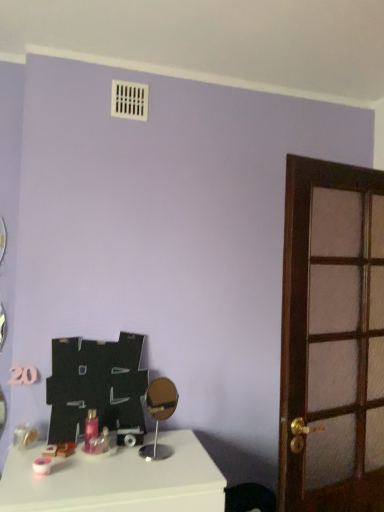
At what (x,y) coordinates should I click in order to perform the action: click on vacant region to the left of pink glossy bottle at center. Please return your answer as a coordinate pair (x, y). This screenshot has height=512, width=384. Looking at the image, I should click on (41, 454).